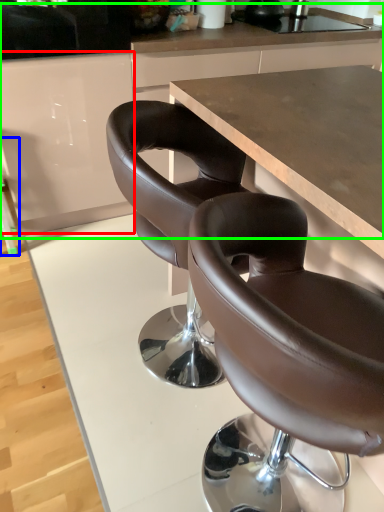
Question: Which is farther away from cabinetry (highlighted by a red box)? bar stool (highlighted by a blue box) or counter (highlighted by a green box)?

Choices:
 (A) bar stool
 (B) counter

Answer: (A)